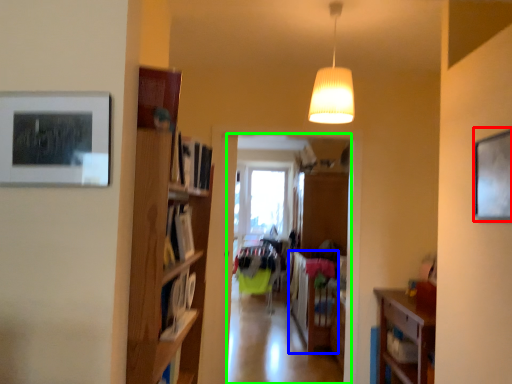
Question: Considering the real-world distances, which object is closest to picture frame (highlighted by a red box)? table (highlighted by a blue box) or clothing store (highlighted by a green box).

Choices:
 (A) table
 (B) clothing store

Answer: (A)